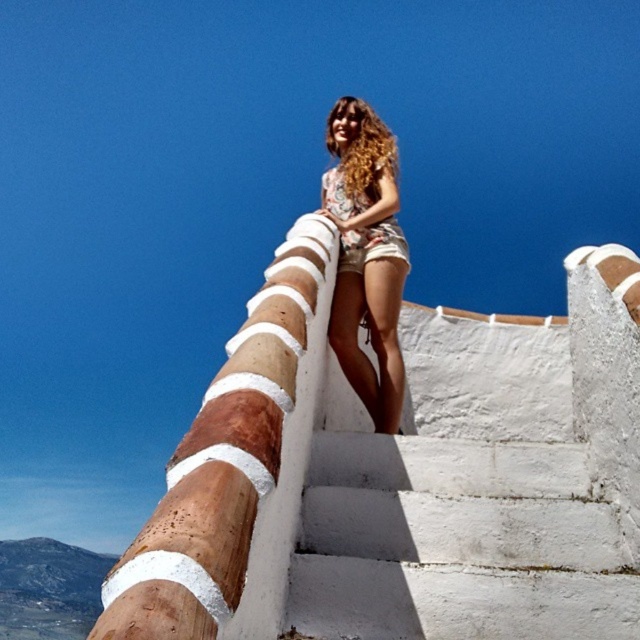
Question: Which of the following is the closest to the observer?

Choices:
 (A) brown wood pole at upper center
 (B) white painted concrete stairs at center
 (C) floral fabric shorts at center
 (D) curly blonde hair at upper center

Answer: (A)

Question: Does white painted concrete stairs at center have a lesser width compared to floral fabric shorts at center?

Choices:
 (A) yes
 (B) no

Answer: (B)

Question: From the image, what is the correct spatial relationship of white painted concrete stairs at center in relation to floral fabric shorts at center?

Choices:
 (A) left
 (B) right

Answer: (B)

Question: Can you confirm if white painted concrete stairs at center is positioned below curly blonde hair at upper center?

Choices:
 (A) no
 (B) yes

Answer: (B)

Question: Which point appears farthest from the camera in this image?

Choices:
 (A) (364, 458)
 (B) (300, 296)

Answer: (A)

Question: Which object is farther from the camera taking this photo?

Choices:
 (A) floral fabric shorts at center
 (B) curly blonde hair at upper center
 (C) brown wood pole at upper center
 (D) white painted concrete stairs at center

Answer: (B)